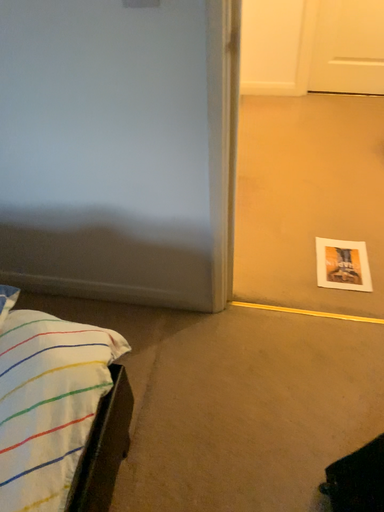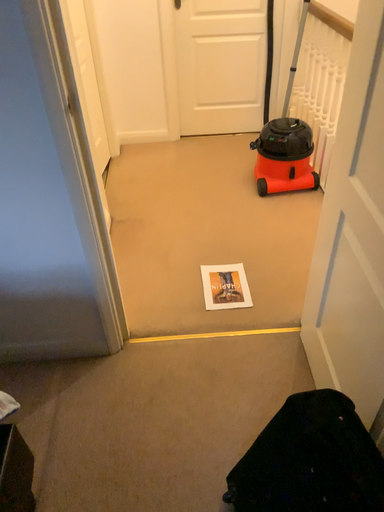
Question: How did the camera likely rotate when shooting the video?

Choices:
 (A) rotated downward
 (B) rotated upward

Answer: (B)